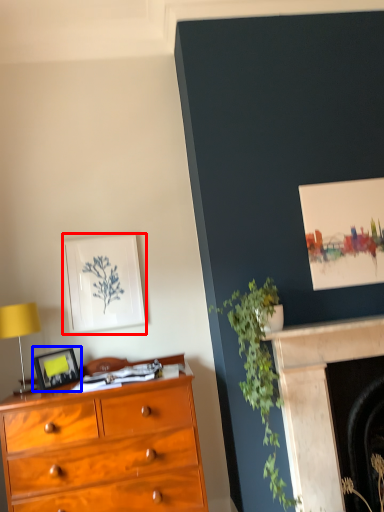
Question: Which object is closer to the camera taking this photo, picture frame (highlighted by a red box) or picture frame (highlighted by a blue box)?

Choices:
 (A) picture frame
 (B) picture frame

Answer: (B)